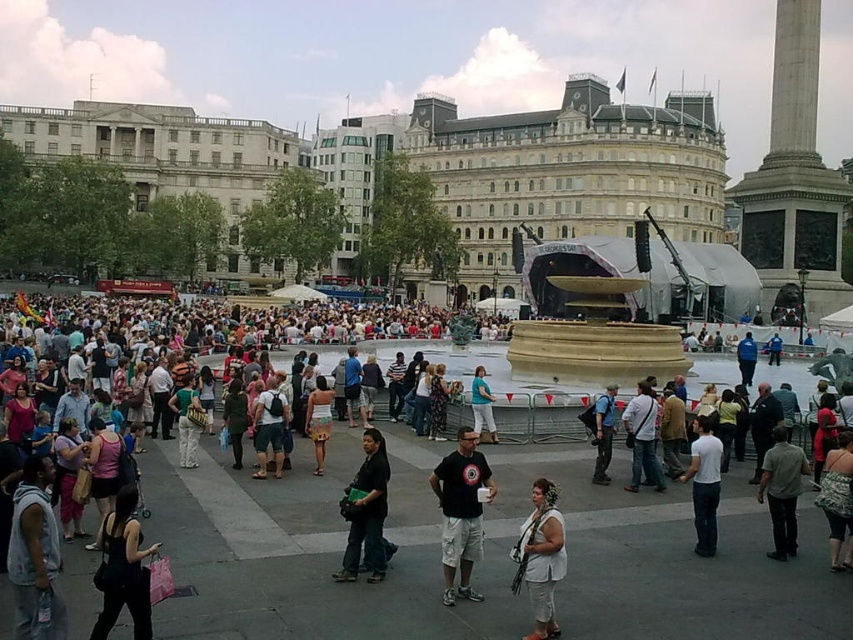
Question: Does beige textured skirt at center have a greater width compared to blue fabric jacket at center?

Choices:
 (A) no
 (B) yes

Answer: (A)

Question: Among these points, which one is nearest to the camera?

Choices:
 (A) (529, 580)
 (B) (480, 480)
 (C) (241, 420)
 (D) (601, 440)

Answer: (A)

Question: Can you confirm if light beige pants at center is thinner than matte blue shirt at center?

Choices:
 (A) no
 (B) yes

Answer: (A)

Question: Which point appears closest to the camera in this image?

Choices:
 (A) (200, 419)
 (B) (849, 518)
 (C) (374, 509)

Answer: (C)

Question: Is the position of light brown leather jacket at center less distant than that of matte blue shirt at center?

Choices:
 (A) yes
 (B) no

Answer: (A)

Question: Which point is closer to the camera?

Choices:
 (A) black fabric dress at lower left
 (B) dark green fabric bag at center
 (C) dark blue backpack at center
 (D) matte black backpack at center

Answer: (A)